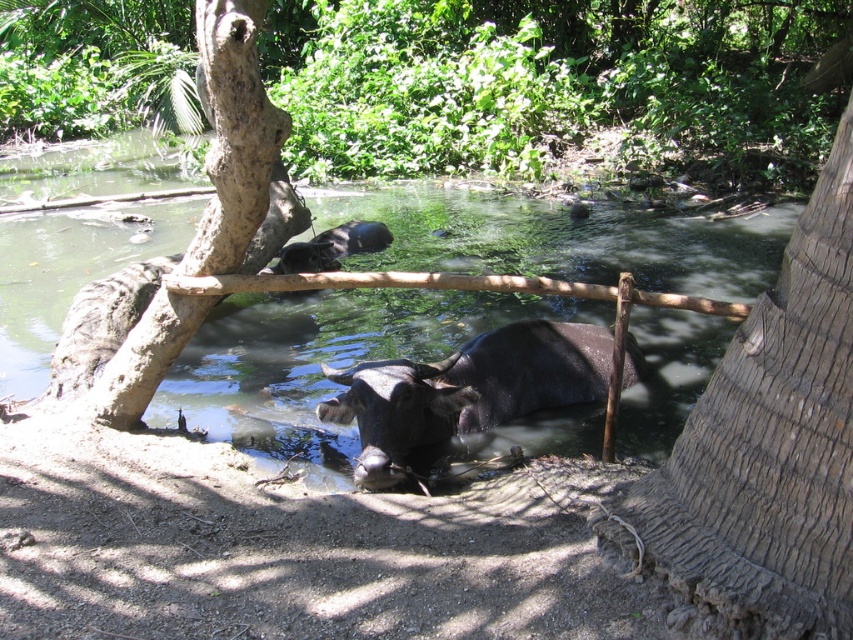
Is clear water at center above shiny dark brown bull at center?

Correct, clear water at center is located above shiny dark brown bull at center.

Can you confirm if clear water at center is thinner than shiny dark brown bull at center?

Incorrect, clear water at center's width is not less than shiny dark brown bull at center's.

Between point (685, 246) and point (508, 324), which one is positioned in front?

Point (508, 324)

The image size is (853, 640). What are the coordinates of `clear water at center` in the screenshot? It's located at (322, 360).